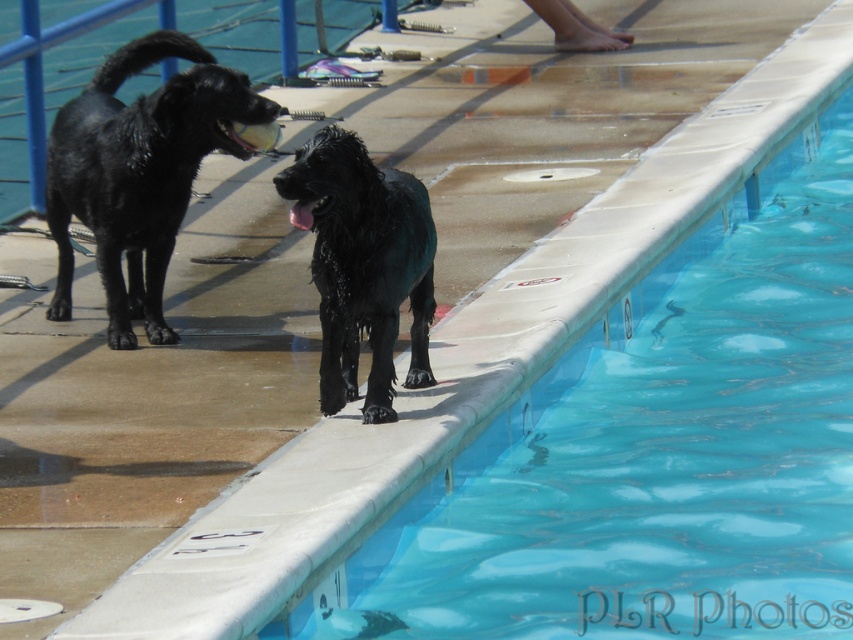
You are a maintenance worker checking the pool area. You need to place a 1.2 meter tall safety sign so it is visible from both the pool deck and the poolside walkway. Which object between the smooth concrete edge at upper right and the brushed metal rail at left should you attach the sign to ensure it is tall enough?

The smooth concrete edge at upper right has a greater height compared to the brushed metal rail at left, so attaching the safety sign to the smooth concrete edge at upper right will ensure it is tall enough to be visible from both the pool deck and the poolside walkway.

You are a photographer trying to capture both the shiny black dog at left and the wet glossy black dog at center. Since you want to include both in the frame, which direction should you move your camera to ensure both are visible?

You should move your camera to the right to ensure both the shiny black dog at left and the wet glossy black dog at center are visible. This way, the shiny black dog at left, which is to the left of the wet glossy black dog at center, will remain in frame while capturing the latter.

You are a small robot with a width of 0.5 meters. You need to move from the shiny black dog at left to the smooth concrete edge at upper right. Is there enough space between them for you to pass through?

The smooth concrete edge at upper right might be wider than the shiny black dog at left, so there may be sufficient space for the robot to pass through. However, without exact measurements, it is uncertain.